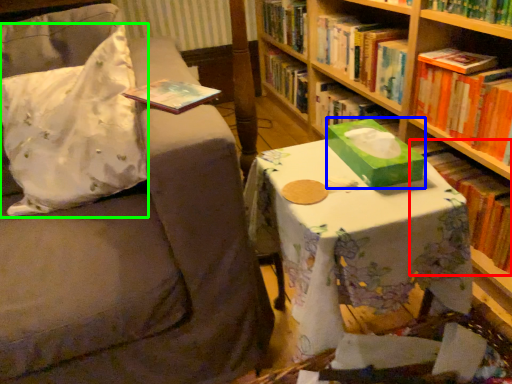
Question: Which object is positioned closest to book (highlighted by a red box)? Select from box (highlighted by a blue box) and throw pillow (highlighted by a green box).

Choices:
 (A) box
 (B) throw pillow

Answer: (A)